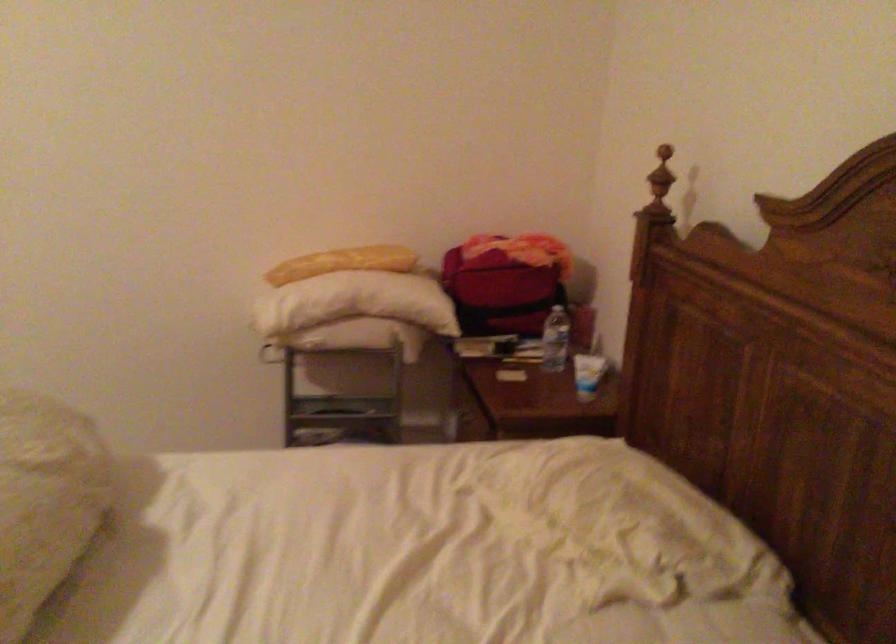
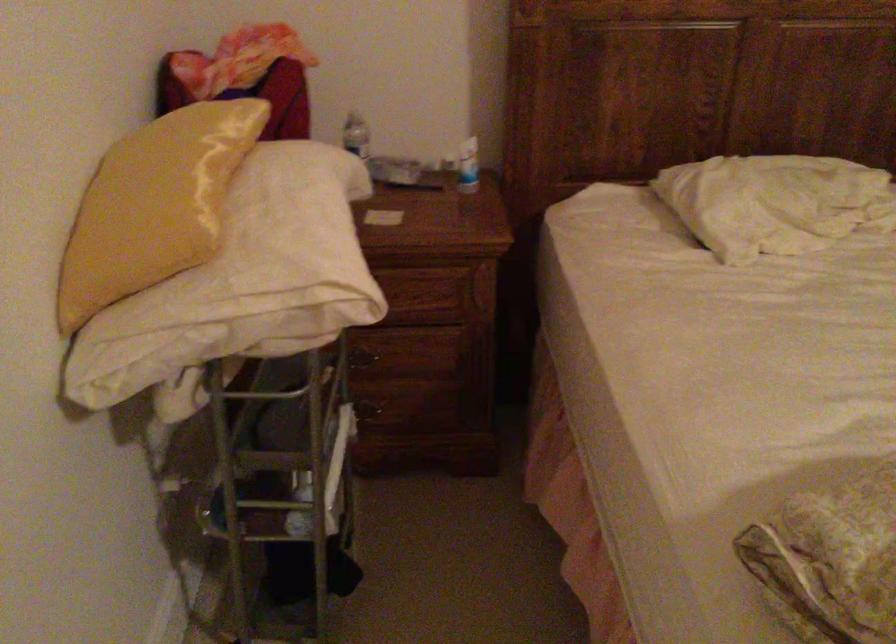
In the second image, find the point that corresponds to [552,478] in the first image.

(774, 202)